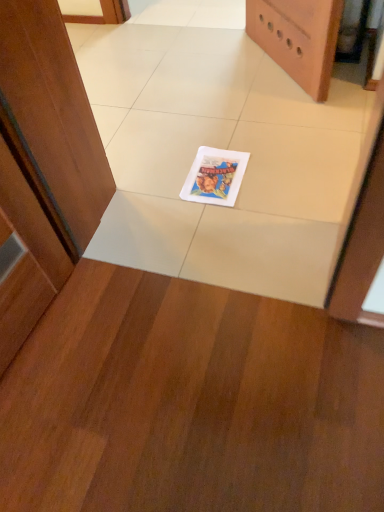
Locate an element on the screen. This screenshot has width=384, height=512. vacant area that lies in front of matte white comic book at center is located at coordinates (231, 219).